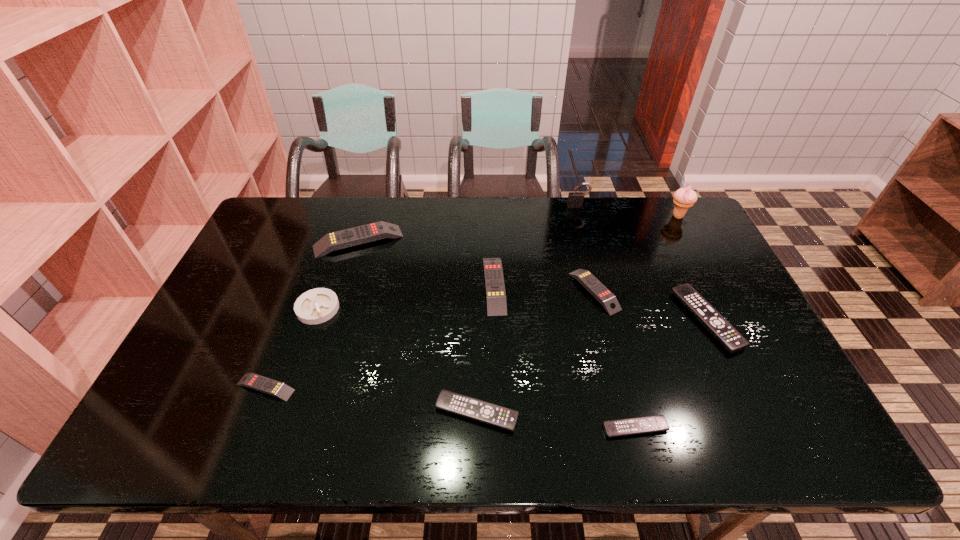
The image size is (960, 540). Identify the location of vacant space that is in between the rightmost black remote control and the rightmost yellow remote control. (650, 305).

Locate an element on the screen. This screenshot has width=960, height=540. vacant region between the padlock and the gray ashtray is located at coordinates (447, 257).

What are the coordinates of `free space that is in between the tallest remote control and the third biggest yellow remote control` in the screenshot? It's located at (476, 266).

What are the coordinates of `vacant area between the second smallest black remote control and the gray ashtray` in the screenshot? It's located at (397, 360).

You are a GUI agent. You are given a task and a screenshot of the screen. Output one action in this format:
    pyautogui.click(x=<x>, y=<y>)
    Task: Click on the free spot between the second farthest object and the farthest black remote control
    The image size is (960, 540).
    Given the screenshot: What is the action you would take?
    pyautogui.click(x=692, y=268)

This screenshot has width=960, height=540. I want to click on empty space between the shortest remote control and the biggest yellow remote control, so click(x=496, y=334).

This screenshot has width=960, height=540. What are the coordinates of `object that ranks as the fifth closest to the shortest remote control` in the screenshot? It's located at (257, 382).

Image resolution: width=960 pixels, height=540 pixels. I want to click on object that is the second closest one to the rightmost yellow remote control, so click(x=493, y=273).

Locate an element on the screen. The height and width of the screenshot is (540, 960). remote control object that ranks as the fourth closest to the biggest yellow remote control is located at coordinates (608, 300).

Find the location of a particular element. The height and width of the screenshot is (540, 960). remote control that is the seventh closest to the second farthest object is located at coordinates (257, 382).